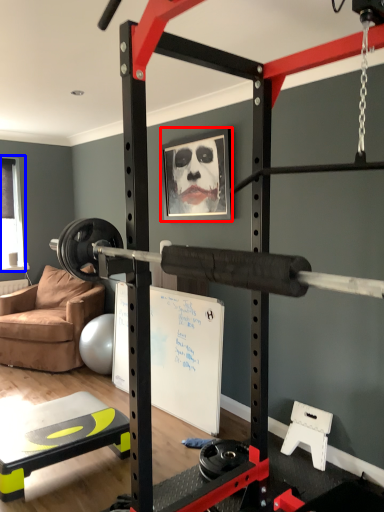
Question: Which object appears closest to the camera in this image, picture frame (highlighted by a red box) or window screen (highlighted by a blue box)?

Choices:
 (A) picture frame
 (B) window screen

Answer: (A)